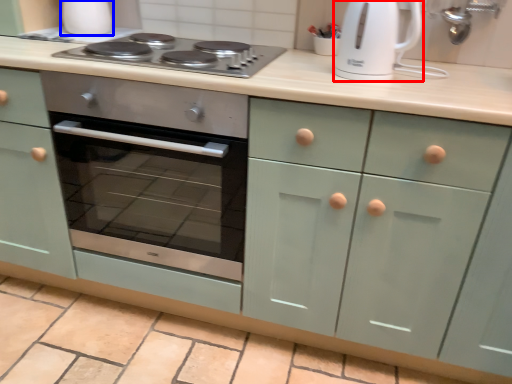
Question: Which point is closer to the camera, kitchen appliance (highlighted by a red box) or appliance (highlighted by a blue box)?

Choices:
 (A) kitchen appliance
 (B) appliance

Answer: (A)